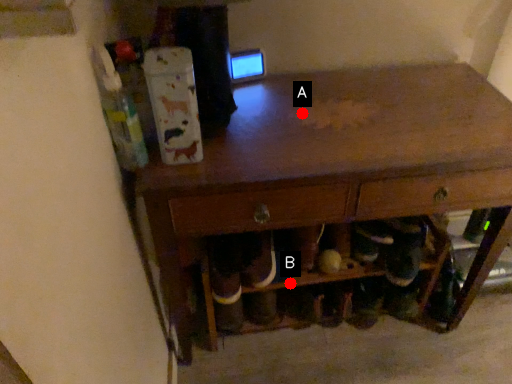
Question: Two points are circled on the image, labeled by A and B beside each circle. Which point is closer to the camera?

Choices:
 (A) A is closer
 (B) B is closer

Answer: (A)